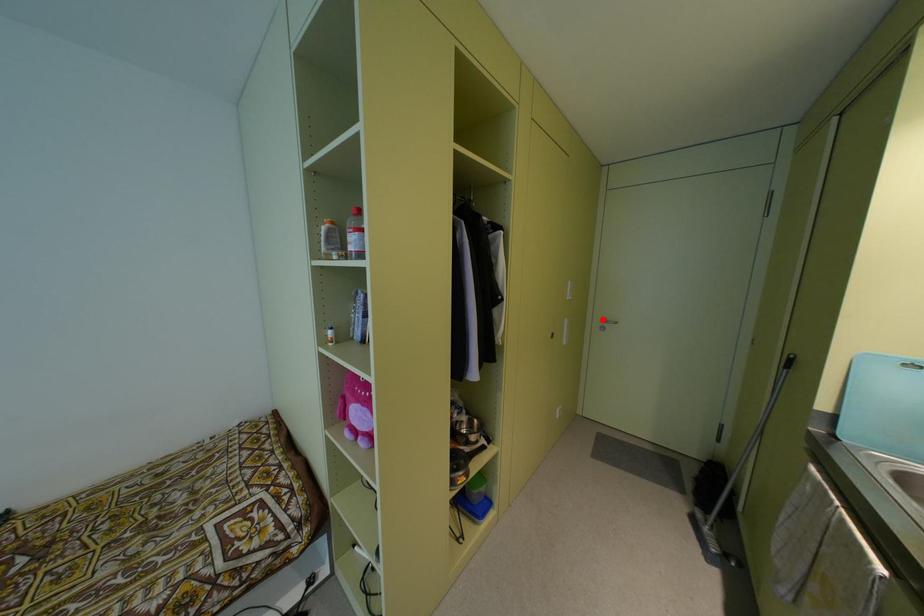
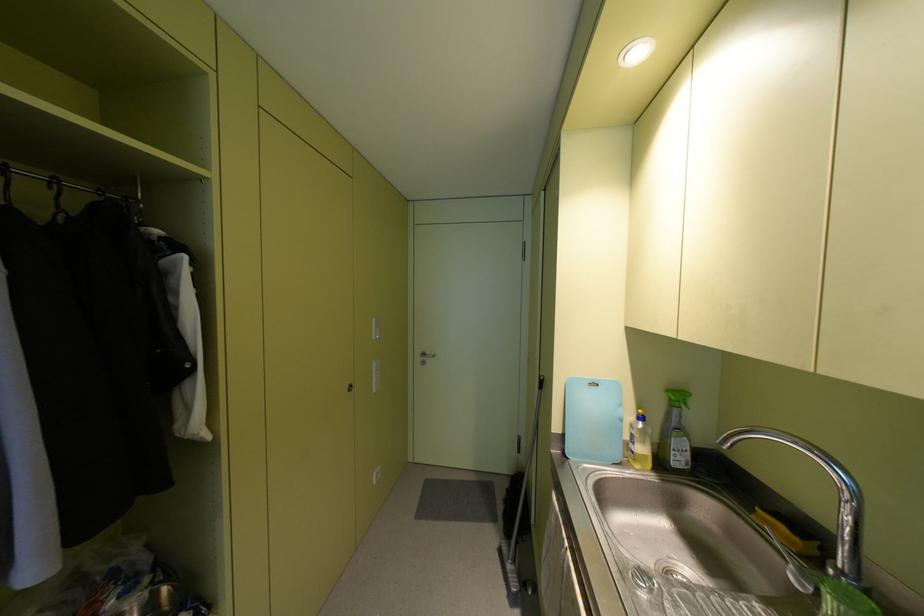
Find the pixel in the second image that matches the highlighted location in the first image.

(422, 354)